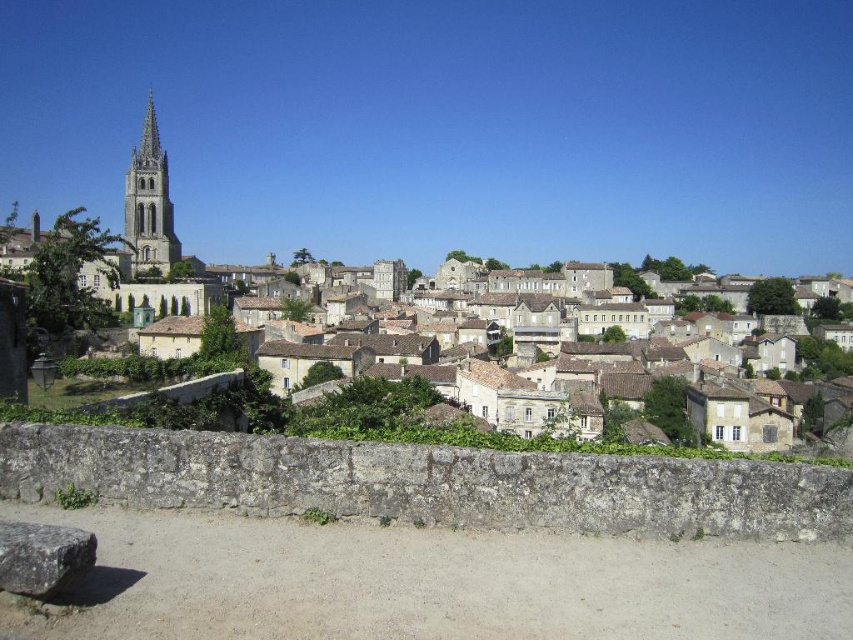
You are an architect visiting the historic town and want to compare the structures. Which one has a greater width between the stone houses at center and the smooth stone tower at upper left?

The stone houses at center have a greater width than the smooth stone tower at upper left.

You are standing on the dirt path in front of the stone wall and want to walk towards the historic town. Which object, the stone houses at center or the smooth stone tower at upper left, should you head towards if you want to reach the town first?

You should head towards the stone houses at center because they are positioned to the right of the smooth stone tower at upper left, meaning they are closer to your current position on the dirt path in front of the stone wall.